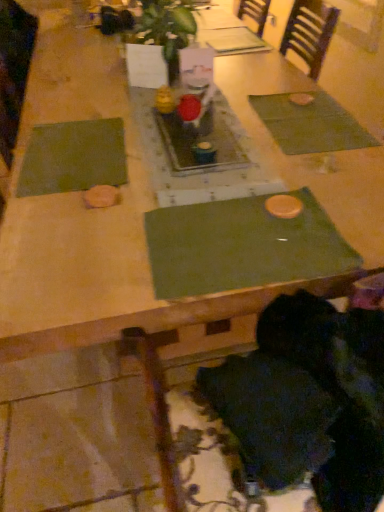
Find the location of a particular element. The width and height of the screenshot is (384, 512). free space behind green fabric place mat at left, which is counted as the third place mat, starting from the right is located at coordinates (84, 106).